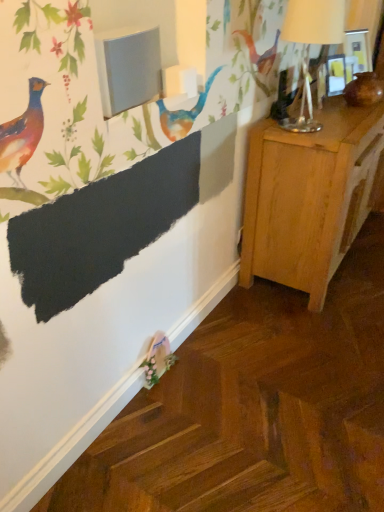
Identify the location of light wood nightstand at right. (309, 196).

What do you see at coordinates (309, 196) in the screenshot?
I see `light wood nightstand at right` at bounding box center [309, 196].

Describe the element at coordinates (309, 47) in the screenshot. I see `metallic silver table lamp at upper right` at that location.

Measure the distance between point (x=279, y=124) and camera.

They are 1.94 meters apart.

From the picture: What is the approximate width of metallic silver table lamp at upper right?

It is 9.93 inches.

Locate an element on the screen. The image size is (384, 512). metallic silver table lamp at upper right is located at coordinates (309, 47).

Where is `light wood nightstand at right`? The image size is (384, 512). light wood nightstand at right is located at coordinates (309, 196).

Considering the positions of objects metallic silver table lamp at upper right and light wood nightstand at right in the image provided, who is more to the left, metallic silver table lamp at upper right or light wood nightstand at right?

metallic silver table lamp at upper right.

Is metallic silver table lamp at upper right behind light wood nightstand at right?

No, metallic silver table lamp at upper right is in front of light wood nightstand at right.

From the picture: Which is less distant, (301, 98) or (311, 262)?

The point (311, 262) is closer to the camera.

From the image's perspective, is metallic silver table lamp at upper right positioned above or below light wood nightstand at right?

From the image's perspective, metallic silver table lamp at upper right appears above light wood nightstand at right.

From a real-world perspective, is metallic silver table lamp at upper right positioned over light wood nightstand at right based on gravity?

Yes, from a real-world perspective, metallic silver table lamp at upper right is over light wood nightstand at right

Which object is thinner, metallic silver table lamp at upper right or light wood nightstand at right?

Thinner between the two is metallic silver table lamp at upper right.

Can you confirm if metallic silver table lamp at upper right is taller than light wood nightstand at right?

No, metallic silver table lamp at upper right is not taller than light wood nightstand at right.

Who is bigger, metallic silver table lamp at upper right or light wood nightstand at right?

Bigger between the two is light wood nightstand at right.

Is metallic silver table lamp at upper right outside of light wood nightstand at right?

Yes, metallic silver table lamp at upper right is outside of light wood nightstand at right.

Is metallic silver table lamp at upper right far away from light wood nightstand at right?

metallic silver table lamp at upper right is near light wood nightstand at right, not far away.

Is metallic silver table lamp at upper right aimed at light wood nightstand at right?

No, metallic silver table lamp at upper right is not facing towards light wood nightstand at right.

Can you tell me how much metallic silver table lamp at upper right and light wood nightstand at right differ in facing direction?

The facing directions of metallic silver table lamp at upper right and light wood nightstand at right are 3.09 degrees apart.

Where is `nightstand lying on the right of metallic silver table lamp at upper right`? nightstand lying on the right of metallic silver table lamp at upper right is located at coordinates (309, 196).

Considering the relative positions of light wood nightstand at right and metallic silver table lamp at upper right in the image provided, is light wood nightstand at right to the left or to the right of metallic silver table lamp at upper right?

light wood nightstand at right is positioned on metallic silver table lamp at upper right's right side.

Is light wood nightstand at right closer to camera compared to metallic silver table lamp at upper right?

No, light wood nightstand at right is behind metallic silver table lamp at upper right.

Considering the positions of points (276, 208) and (308, 44), is point (276, 208) farther from camera compared to point (308, 44)?

No.

From the image's perspective, is light wood nightstand at right beneath metallic silver table lamp at upper right?

Indeed, from the image's perspective, light wood nightstand at right is shown beneath metallic silver table lamp at upper right.

From a real-world perspective, is light wood nightstand at right above or below metallic silver table lamp at upper right?

light wood nightstand at right is situated lower than metallic silver table lamp at upper right in the real world.

Does light wood nightstand at right have a lesser width compared to metallic silver table lamp at upper right?

In fact, light wood nightstand at right might be wider than metallic silver table lamp at upper right.

Between light wood nightstand at right and metallic silver table lamp at upper right, which one has less height?

metallic silver table lamp at upper right.

Which of these two, light wood nightstand at right or metallic silver table lamp at upper right, is bigger?

Bigger between the two is light wood nightstand at right.

Do you think light wood nightstand at right is within metallic silver table lamp at upper right, or outside of it?

light wood nightstand at right exists outside the volume of metallic silver table lamp at upper right.

Is light wood nightstand at right touching metallic silver table lamp at upper right?

There is a gap between light wood nightstand at right and metallic silver table lamp at upper right.

Is light wood nightstand at right facing away from metallic silver table lamp at upper right?

light wood nightstand at right is not turned away from metallic silver table lamp at upper right.

How distant is light wood nightstand at right from metallic silver table lamp at upper right?

They are 25.40 inches apart.

I want to click on table lamp above the light wood nightstand at right (from the image's perspective), so click(309, 47).

Find the location of a particular element. This screenshot has height=512, width=384. table lamp above the light wood nightstand at right (from the image's perspective) is located at coordinates (309, 47).

Where is `nightstand located behind the metallic silver table lamp at upper right`? The image size is (384, 512). nightstand located behind the metallic silver table lamp at upper right is located at coordinates (309, 196).